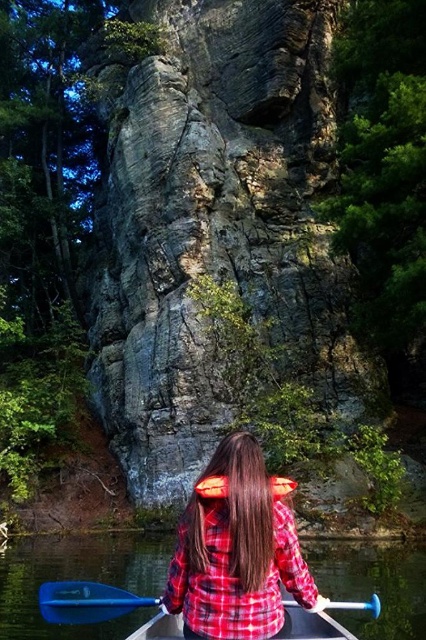
This screenshot has width=426, height=640. What are the coordinates of `blue plastic canoe at center` in the screenshot? It's located at (311, 624).

Image resolution: width=426 pixels, height=640 pixels. What are the coordinates of `blue plastic canoe at center` in the screenshot? It's located at (311, 624).

Is point (152, 13) positioned behind point (331, 627)?

Yes, point (152, 13) is farther from viewer.

Can you confirm if gray rough rock at center is smaller than blue plastic canoe at center?

Incorrect, gray rough rock at center is not smaller in size than blue plastic canoe at center.

Which is behind, point (141, 179) or point (359, 605)?

Point (141, 179)

You are a GUI agent. You are given a task and a screenshot of the screen. Output one action in this format:
    pyautogui.click(x=<x>, y=<y>)
    Task: Click on the gray rough rock at center
    
    Given the screenshot: What is the action you would take?
    pyautogui.click(x=213, y=227)

Can you confirm if clear water at lower center is positioned to the left of blue plastic paddle at lower center?

Indeed, clear water at lower center is positioned on the left side of blue plastic paddle at lower center.

I want to click on clear water at lower center, so click(78, 579).

Where is `clear water at lower center`? Image resolution: width=426 pixels, height=640 pixels. clear water at lower center is located at coordinates (78, 579).

Find the location of `clear water at lower center`. clear water at lower center is located at coordinates (78, 579).